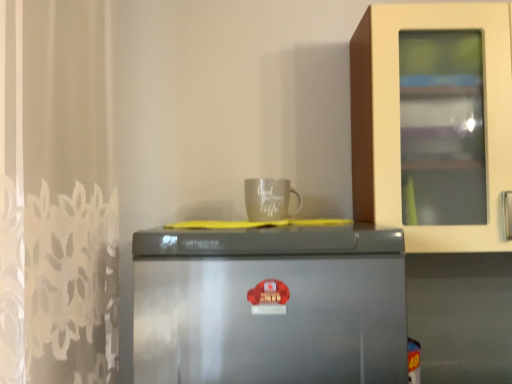
Question: Is satin silver fridge at center facing away from gray matte mug at upper center?

Choices:
 (A) no
 (B) yes

Answer: (A)

Question: Does satin silver fridge at center turn towards gray matte mug at upper center?

Choices:
 (A) yes
 (B) no

Answer: (B)

Question: From the image's perspective, is satin silver fridge at center over gray matte mug at upper center?

Choices:
 (A) no
 (B) yes

Answer: (A)

Question: Is satin silver fridge at center at the right side of gray matte mug at upper center?

Choices:
 (A) yes
 (B) no

Answer: (B)

Question: Is the position of satin silver fridge at center less distant than that of gray matte mug at upper center?

Choices:
 (A) no
 (B) yes

Answer: (B)

Question: Can you see satin silver fridge at center touching gray matte mug at upper center?

Choices:
 (A) no
 (B) yes

Answer: (A)

Question: Is the position of gray matte mug at upper center less distant than that of satin silver fridge at center?

Choices:
 (A) no
 (B) yes

Answer: (A)

Question: From the image's perspective, is gray matte mug at upper center above satin silver fridge at center?

Choices:
 (A) no
 (B) yes

Answer: (B)

Question: Considering the relative sizes of gray matte mug at upper center and satin silver fridge at center in the image provided, is gray matte mug at upper center bigger than satin silver fridge at center?

Choices:
 (A) yes
 (B) no

Answer: (B)

Question: Is gray matte mug at upper center far from satin silver fridge at center?

Choices:
 (A) yes
 (B) no

Answer: (B)

Question: Does gray matte mug at upper center have a lesser width compared to satin silver fridge at center?

Choices:
 (A) no
 (B) yes

Answer: (B)

Question: Is gray matte mug at upper center outside of satin silver fridge at center?

Choices:
 (A) no
 (B) yes

Answer: (B)

Question: From a real-world perspective, is gray matte mug at upper center physically located above or below satin silver fridge at center?

Choices:
 (A) above
 (B) below

Answer: (A)